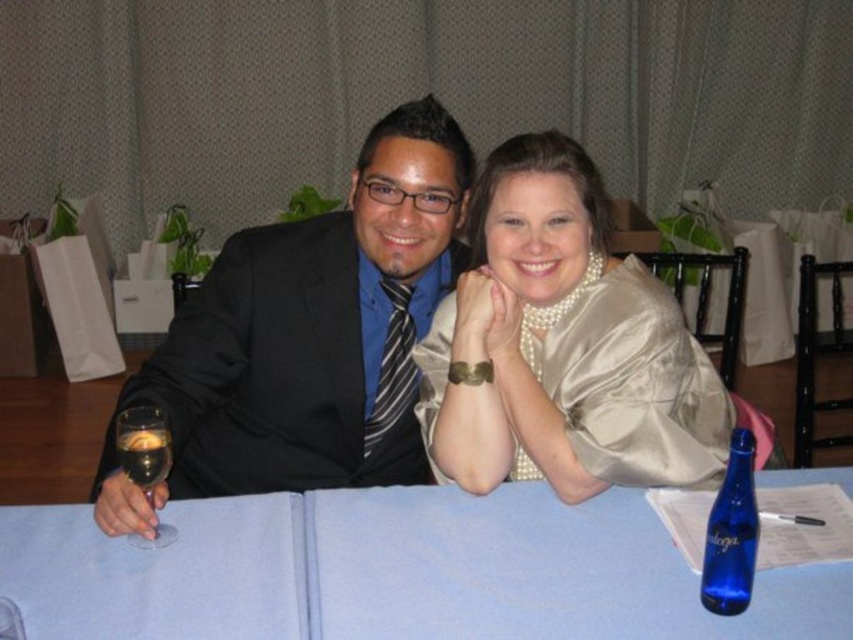
Question: Is blue fabric table at center in front of blue glass bottle at lower right?

Choices:
 (A) no
 (B) yes

Answer: (A)

Question: Which of these objects is positioned farthest from the blue glass bottle at lower right?

Choices:
 (A) black satin suit at center
 (B) satin gold dress at center
 (C) blue fabric table at center

Answer: (A)

Question: Is black satin suit at center above clear glass wine glass at left?

Choices:
 (A) yes
 (B) no

Answer: (A)

Question: Among these points, which one is farthest from the camera?

Choices:
 (A) (717, 547)
 (B) (149, 493)
 (C) (691, 444)

Answer: (C)

Question: Does blue fabric table at center have a smaller size compared to blue glass bottle at lower right?

Choices:
 (A) yes
 (B) no

Answer: (B)

Question: Which of the following is the closest to the observer?

Choices:
 (A) blue fabric table at center
 (B) satin gold dress at center

Answer: (A)